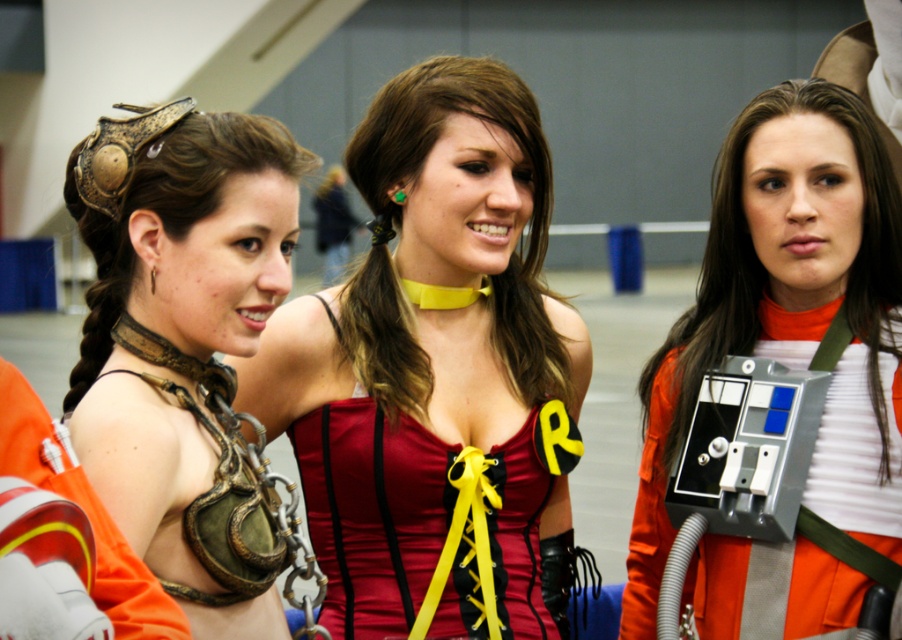
Does gold metallic armor at left have a lesser width compared to matte yellow choker at center?

Yes, gold metallic armor at left is thinner than matte yellow choker at center.

Between gold metallic armor at left and matte yellow choker at center, which one has more height?

With more height is gold metallic armor at left.

Is point (131, 524) closer to viewer compared to point (369, 320)?

That is True.

Identify the location of gold metallic armor at left. (182, 342).

Does shiny red corset at center have a larger size compared to orange fabric spacesuit at center?

Yes, shiny red corset at center is bigger than orange fabric spacesuit at center.

Can you confirm if shiny red corset at center is taller than orange fabric spacesuit at center?

Indeed, shiny red corset at center has a greater height compared to orange fabric spacesuit at center.

Where is `shiny red corset at center`? The height and width of the screenshot is (640, 902). shiny red corset at center is located at coordinates (436, 372).

Is orange fabric spacesuit at center wider than matte yellow choker at center?

Yes.

Find the location of a particular element. The width and height of the screenshot is (902, 640). orange fabric spacesuit at center is located at coordinates (788, 314).